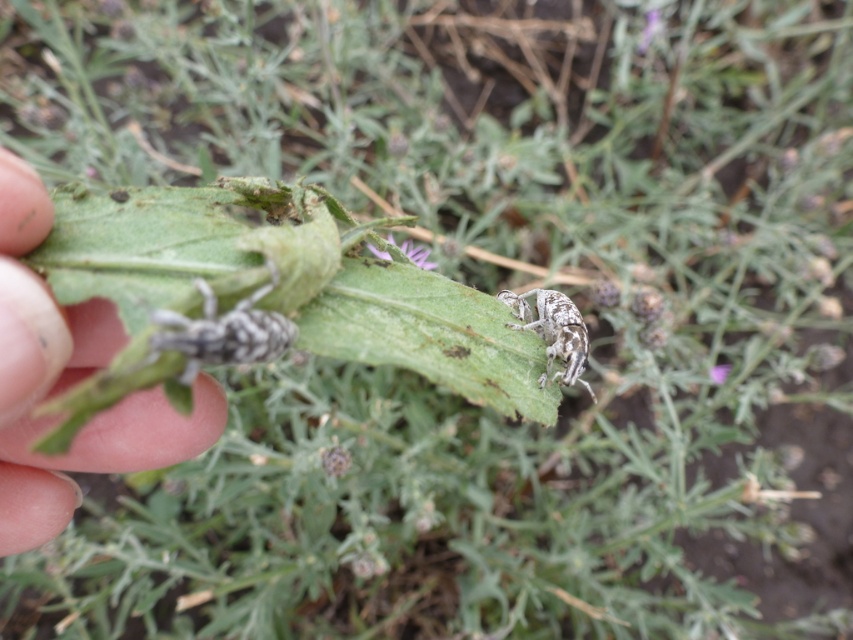
You are a researcher examining a plant with insects. You notice a point at coordinates point (68, 381). Based on the scene description, what is this point likely representing?

The point at coordinates point (68, 381) is likely representing flesh toned skin at lower left, which is part of the human hand holding the leaf.